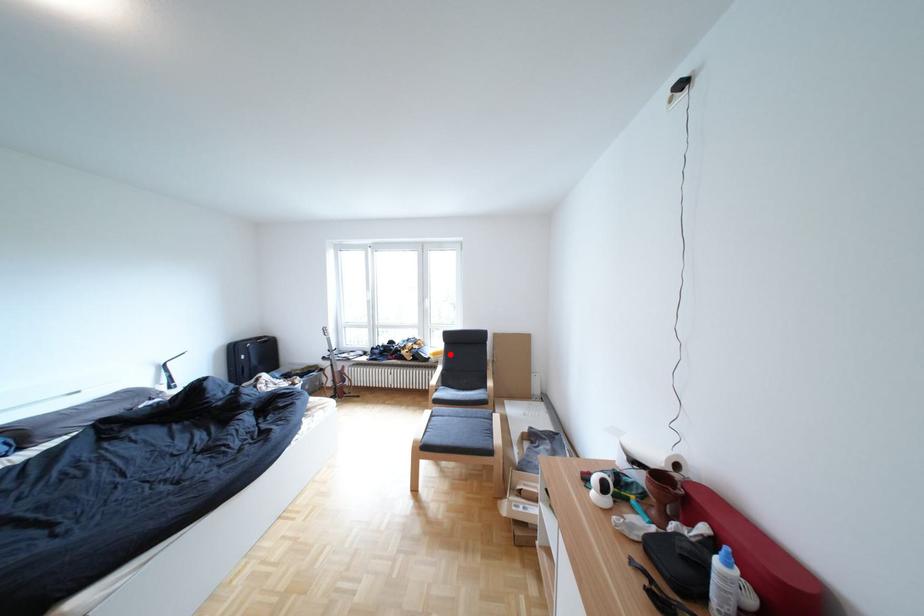
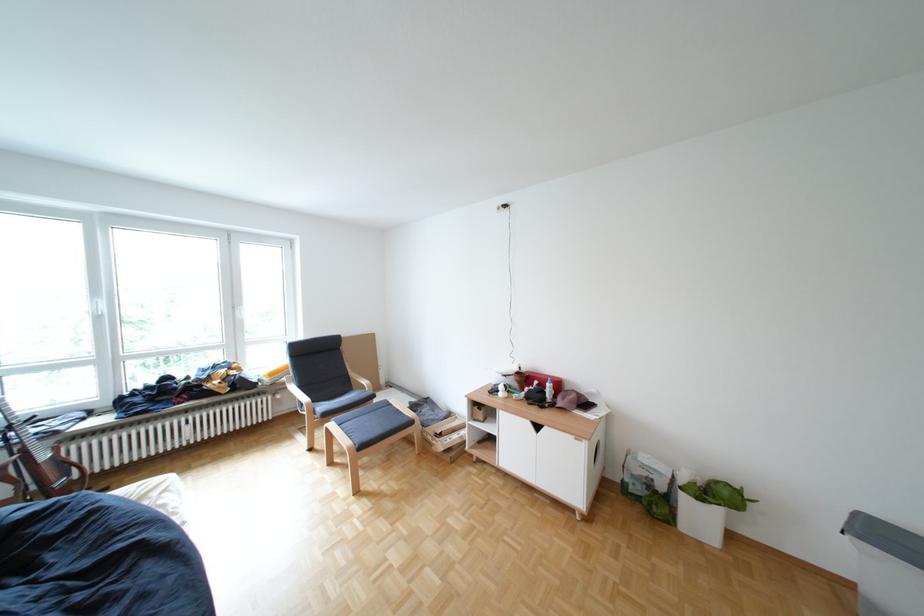
Question: A red point is marked in image1. In image2, is the corresponding 3D point closer to the camera or farther? Reply with the corresponding letter.

Choices:
 (A) The corresponding 3D point is closer.
 (B) The corresponding 3D point is farther.

Answer: (A)